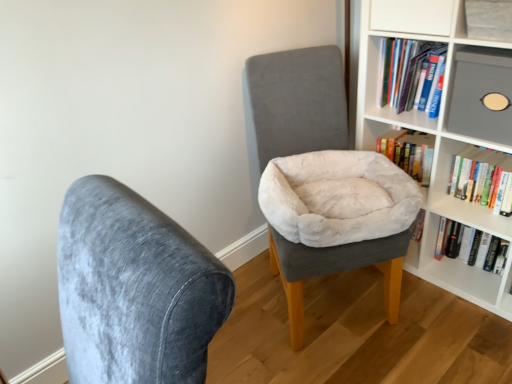
Question: From a real-world perspective, is velvet gray chair at center, marked as the 1th chair in a back-to-front arrangement, over hardcover book at upper right, the first book when ordered from top to bottom?

Choices:
 (A) no
 (B) yes

Answer: (B)

Question: Is the position of velvet gray chair at center, which ranks as the 1th chair in right-to-left order, less distant than that of hardcover book at upper right, the 3th book when ordered from bottom to top?

Choices:
 (A) yes
 (B) no

Answer: (A)

Question: Would you consider velvet gray chair at center, which ranks as the 1th chair in right-to-left order, to be distant from hardcover book at upper right, the 3th book when ordered from bottom to top?

Choices:
 (A) no
 (B) yes

Answer: (A)

Question: Is velvet gray chair at center, marked as the 1th chair in a back-to-front arrangement, positioned behind hardcover book at upper right, the first book when ordered from top to bottom?

Choices:
 (A) yes
 (B) no

Answer: (B)

Question: Does velvet gray chair at center, marked as the 1th chair in a back-to-front arrangement, have a smaller size compared to hardcover book at upper right, the 3th book when ordered from bottom to top?

Choices:
 (A) no
 (B) yes

Answer: (A)

Question: Considering the positions of beige plush bean bag chair at center and velvet gray chair at center, acting as the second chair starting from the back, in the image, is beige plush bean bag chair at center bigger or smaller than velvet gray chair at center, acting as the second chair starting from the back,?

Choices:
 (A) big
 (B) small

Answer: (B)

Question: Looking at their shapes, would you say beige plush bean bag chair at center is wider or thinner than velvet gray chair at center, acting as the second chair starting from the back?

Choices:
 (A) wide
 (B) thin

Answer: (A)

Question: From a real-world perspective, is beige plush bean bag chair at center positioned above or below velvet gray chair at center, positioned as the 1th chair in left-to-right order?

Choices:
 (A) above
 (B) below

Answer: (B)

Question: Considering their positions, is beige plush bean bag chair at center located in front of or behind velvet gray chair at center, acting as the second chair starting from the back?

Choices:
 (A) front
 (B) behind

Answer: (B)

Question: Considering the positions of hardcover book at right, the third book positioned from the top, and hardcover book at upper right, the 3th book when ordered from bottom to top, in the image, is hardcover book at right, the third book positioned from the top, bigger or smaller than hardcover book at upper right, the 3th book when ordered from bottom to top,?

Choices:
 (A) big
 (B) small

Answer: (A)

Question: Is hardcover book at right, the third book positioned from the top, inside the boundaries of hardcover book at upper right, the first book when ordered from top to bottom, or outside?

Choices:
 (A) outside
 (B) inside

Answer: (A)

Question: In terms of height, does hardcover book at right, the third book positioned from the top, look taller or shorter compared to hardcover book at upper right, the first book when ordered from top to bottom?

Choices:
 (A) short
 (B) tall

Answer: (B)

Question: From the image's perspective, is hardcover book at right, the third book positioned from the top, above or below hardcover book at upper right, the 3th book when ordered from bottom to top?

Choices:
 (A) above
 (B) below

Answer: (B)

Question: Considering the positions of matte gray shelf at upper right, which appears as the 1th shelf when viewed from the top, and velvet gray chair at center, the second chair in the front-to-back sequence, in the image, is matte gray shelf at upper right, which appears as the 1th shelf when viewed from the top, wider or thinner than velvet gray chair at center, the second chair in the front-to-back sequence,?

Choices:
 (A) thin
 (B) wide

Answer: (A)

Question: In terms of size, does matte gray shelf at upper right, which appears as the second shelf when ordered from the bottom, appear bigger or smaller than velvet gray chair at center, marked as the 1th chair in a back-to-front arrangement?

Choices:
 (A) big
 (B) small

Answer: (B)